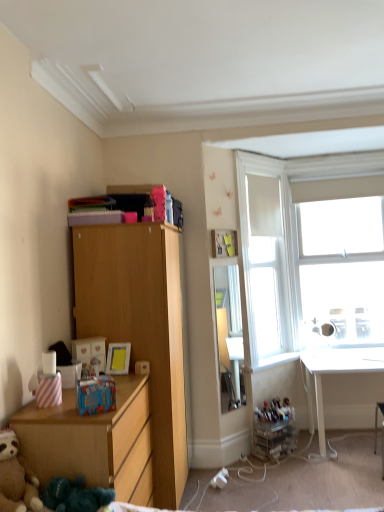
The image size is (384, 512). What are the coordinates of `vacant region to the right of white plastic power outlet at lower center` in the screenshot? It's located at (241, 486).